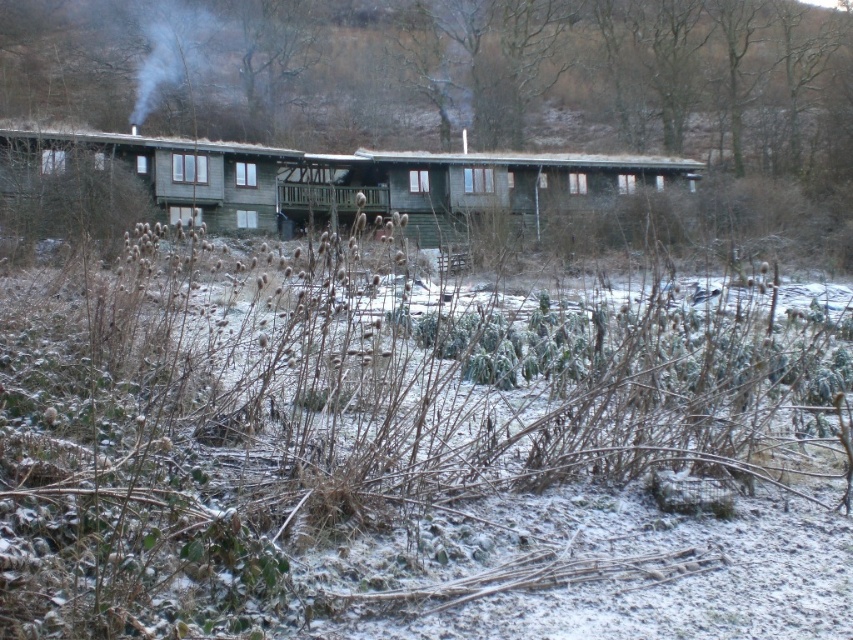
You are planning to build a new shed next to the green wood cabin at center and the green wooden hut at left. Based on their widths, which one would require more materials for the base if they were to be expanded equally in width?

The green wood cabin at center might require more materials for the base since it is wider than the green wooden hut at left according to the description.

You are planning to build a shed in your backyard and want to compare the sizes of the structures in the image. Which one is bigger between the green wood cabin at center and the green wooden hut at left?

The green wood cabin at center is larger in size compared to the green wooden hut at left.

You are standing outside the green wood cabin at center and want to walk towards the green wooden hut at left. Which direction should you face to move towards it?

You should face towards the left direction to move towards the green wooden hut at left since it is located to the left side of the green wood cabin at center.